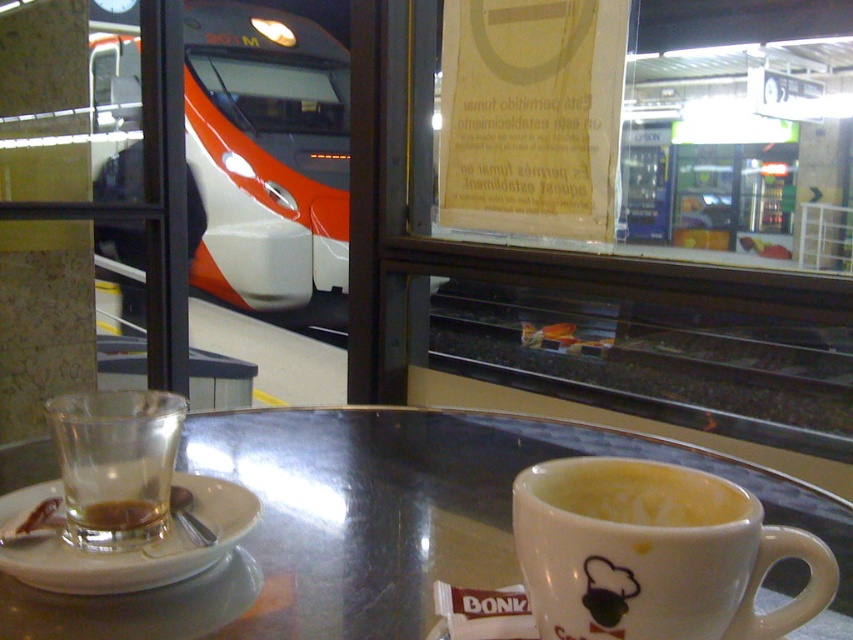
Is orange glossy train at upper left taller than white glossy mug at lower center?

Correct, orange glossy train at upper left is much taller as white glossy mug at lower center.

In the scene shown: Does orange glossy train at upper left appear on the right side of white glossy mug at lower center?

Incorrect, orange glossy train at upper left is not on the right side of white glossy mug at lower center.

Does point (340, 227) come closer to viewer compared to point (660, 499)?

No, it is not.

In order to click on orange glossy train at upper left in this screenshot , I will do `click(265, 154)`.

Where is `translucent glass at table left`? translucent glass at table left is located at coordinates click(115, 464).

Between point (103, 444) and point (132, 522), which one is positioned behind?

The point (132, 522) is behind.

Is point (167, 394) closer to camera compared to point (123, 515)?

No, (167, 394) is further to viewer.

Find the location of `translucent glass at table left`. translucent glass at table left is located at coordinates (115, 464).

Does white glossy mug at lower center appear on the left side of translucent glass cup at lower left?

No, white glossy mug at lower center is not to the left of translucent glass cup at lower left.

Does point (630, 536) come closer to viewer compared to point (96, 524)?

Yes, it is.

Where is `white glossy mug at lower center`? This screenshot has height=640, width=853. white glossy mug at lower center is located at coordinates (654, 554).